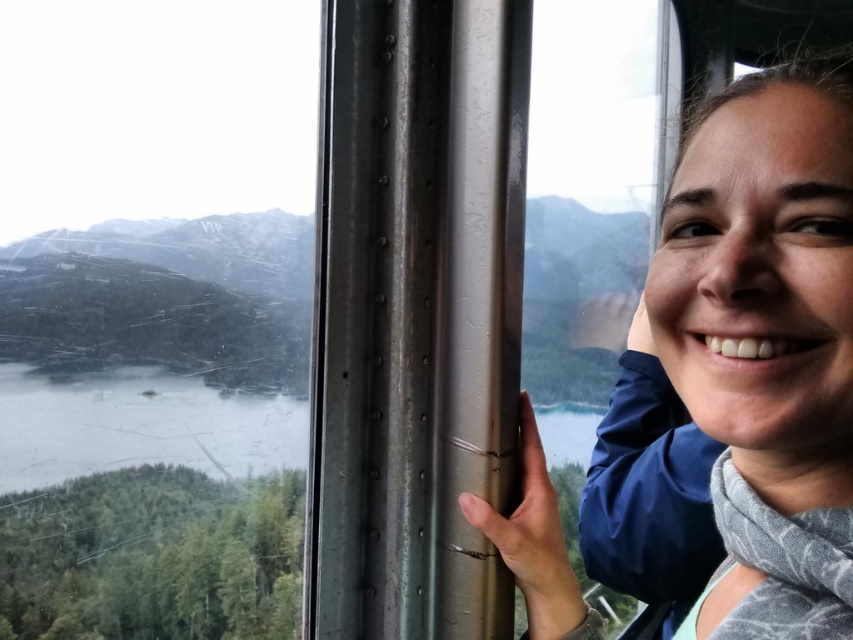
Question: From the image, what is the correct spatial relationship of matte blue jacket at right in relation to green matte water at center?

Choices:
 (A) right
 (B) left

Answer: (A)

Question: Is matte blue jacket at right smaller than green matte water at center?

Choices:
 (A) yes
 (B) no

Answer: (B)

Question: Which of the following is the closest to the observer?

Choices:
 (A) green matte water at center
 (B) matte blue jacket at right

Answer: (B)

Question: Is matte blue jacket at right smaller than green matte water at center?

Choices:
 (A) yes
 (B) no

Answer: (B)